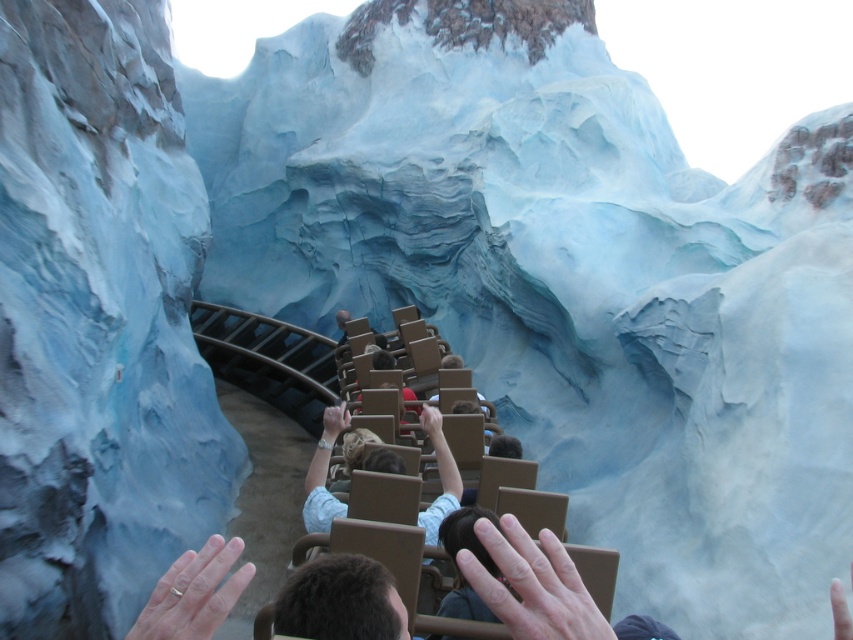
Based on the photo, you are a photographer taking a picture of the smooth skin hand at center and the light skin tone flesh at center. Which object should you focus on first if you want to capture both in sharp detail?

The smooth skin hand at center is shorter than the light skin tone flesh at center, so you should focus on the light skin tone flesh at center first since it is farther away and requires a smaller depth of field to keep both in focus.